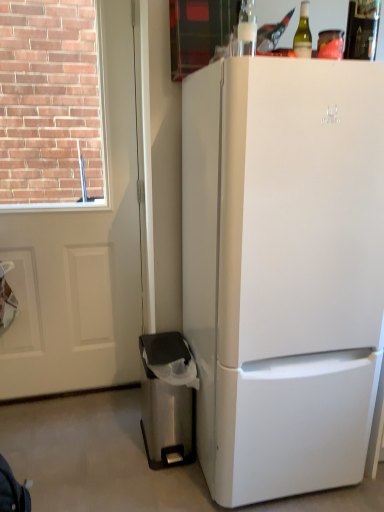
Describe the element at coordinates (303, 33) in the screenshot. Image resolution: width=384 pixels, height=512 pixels. I see `green glass bottle at upper center, which ranks as the second bottle in right-to-left order` at that location.

I want to click on white matte screen door at left, so click(x=81, y=254).

Describe the element at coordinates (81, 254) in the screenshot. I see `white matte screen door at left` at that location.

Where is `white matte refrigerator at right`? This screenshot has height=512, width=384. white matte refrigerator at right is located at coordinates (283, 270).

The width and height of the screenshot is (384, 512). I want to click on stainless steel trash can at lower left, so click(x=168, y=399).

Where is `green glass bottle at upper right, which is the 2th bottle from left to right`? This screenshot has width=384, height=512. green glass bottle at upper right, which is the 2th bottle from left to right is located at coordinates (362, 29).

Image resolution: width=384 pixels, height=512 pixels. Find the location of `green glass bottle at upper center, arranged as the 1th bottle when viewed from the left`. green glass bottle at upper center, arranged as the 1th bottle when viewed from the left is located at coordinates (303, 33).

Are white matte refrigerator at right and stainless steel trash can at lower left beside each other?

No, white matte refrigerator at right is not beside stainless steel trash can at lower left.

Is white matte refrigerator at right facing away from stainless steel trash can at lower left?

No, white matte refrigerator at right's orientation is not away from stainless steel trash can at lower left.

From a real-world perspective, is white matte refrigerator at right positioned above or below stainless steel trash can at lower left?

Clearly, from a real-world perspective, white matte refrigerator at right is above stainless steel trash can at lower left.

Is white matte refrigerator at right at the left side of stainless steel trash can at lower left?

Incorrect, white matte refrigerator at right is not on the left side of stainless steel trash can at lower left.

Could you tell me if white matte refrigerator at right is turned towards green glass bottle at upper right, which is the 2th bottle from left to right?

No.

Does white matte refrigerator at right have a lesser height compared to green glass bottle at upper right, which is the 2th bottle from left to right?

Incorrect, the height of white matte refrigerator at right does not fall short of that of green glass bottle at upper right, which is the 2th bottle from left to right.

Which object is wider, white matte refrigerator at right or green glass bottle at upper right, arranged as the 1th bottle when viewed from the right?

With larger width is white matte refrigerator at right.

Where is `bottle that is the 1st object above the white matte refrigerator at right (from a real-world perspective)`? This screenshot has height=512, width=384. bottle that is the 1st object above the white matte refrigerator at right (from a real-world perspective) is located at coordinates (303, 33).

Is white matte refrigerator at right situated inside green glass bottle at upper center, arranged as the 1th bottle when viewed from the left, or outside?

white matte refrigerator at right exists outside the volume of green glass bottle at upper center, arranged as the 1th bottle when viewed from the left.

Is white matte refrigerator at right with green glass bottle at upper center, arranged as the 1th bottle when viewed from the left?

There is a gap between white matte refrigerator at right and green glass bottle at upper center, arranged as the 1th bottle when viewed from the left.

Would you consider green glass bottle at upper center, which ranks as the second bottle in right-to-left order, to be distant from white matte refrigerator at right?

No, green glass bottle at upper center, which ranks as the second bottle in right-to-left order, is in close proximity to white matte refrigerator at right.

Which object is wider, green glass bottle at upper center, arranged as the 1th bottle when viewed from the left, or white matte refrigerator at right?

white matte refrigerator at right.

From their relative heights in the image, would you say green glass bottle at upper center, arranged as the 1th bottle when viewed from the left, is taller or shorter than white matte refrigerator at right?

In the image, green glass bottle at upper center, arranged as the 1th bottle when viewed from the left, appears to be shorter than white matte refrigerator at right.

Which is behind, point (305, 9) or point (265, 177)?

Positioned behind is point (305, 9).

Which is behind, green glass bottle at upper right, arranged as the 1th bottle when viewed from the right, or white matte refrigerator at right?

green glass bottle at upper right, arranged as the 1th bottle when viewed from the right, is further away from the camera.

Consider the image. What's the angular difference between green glass bottle at upper right, arranged as the 1th bottle when viewed from the right, and white matte refrigerator at right's facing directions?

The angular difference between green glass bottle at upper right, arranged as the 1th bottle when viewed from the right, and white matte refrigerator at right is 0.634 degrees.

Between green glass bottle at upper right, arranged as the 1th bottle when viewed from the right, and white matte refrigerator at right, which one has less height?

green glass bottle at upper right, arranged as the 1th bottle when viewed from the right, is shorter.

Could you measure the distance between green glass bottle at upper right, which is the 2th bottle from left to right, and white matte refrigerator at right?

27.56 inches.

Does point (305, 38) appear closer or farther from the camera than point (180, 375)?

Point (305, 38) is closer to the camera than point (180, 375).

Considering the relative positions of green glass bottle at upper center, which ranks as the second bottle in right-to-left order, and stainless steel trash can at lower left in the image provided, is green glass bottle at upper center, which ranks as the second bottle in right-to-left order, to the right of stainless steel trash can at lower left from the viewer's perspective?

Yes.

Considering their positions, is green glass bottle at upper center, which ranks as the second bottle in right-to-left order, located in front of or behind stainless steel trash can at lower left?

Visually, green glass bottle at upper center, which ranks as the second bottle in right-to-left order, is located in front of stainless steel trash can at lower left.

Based on the photo, which of these two, green glass bottle at upper center, arranged as the 1th bottle when viewed from the left, or stainless steel trash can at lower left, is wider?

Wider between the two is stainless steel trash can at lower left.

Considering the sizes of objects green glass bottle at upper center, which ranks as the second bottle in right-to-left order, and green glass bottle at upper right, arranged as the 1th bottle when viewed from the right, in the image provided, who is smaller, green glass bottle at upper center, which ranks as the second bottle in right-to-left order, or green glass bottle at upper right, arranged as the 1th bottle when viewed from the right,?

With smaller size is green glass bottle at upper center, which ranks as the second bottle in right-to-left order.

Is green glass bottle at upper center, arranged as the 1th bottle when viewed from the left, placed right next to green glass bottle at upper right, arranged as the 1th bottle when viewed from the right?

No, green glass bottle at upper center, arranged as the 1th bottle when viewed from the left, is not in contact with green glass bottle at upper right, arranged as the 1th bottle when viewed from the right.

Considering the positions of objects green glass bottle at upper center, which ranks as the second bottle in right-to-left order, and green glass bottle at upper right, which is the 2th bottle from left to right, in the image provided, who is more to the left, green glass bottle at upper center, which ranks as the second bottle in right-to-left order, or green glass bottle at upper right, which is the 2th bottle from left to right,?

From the viewer's perspective, green glass bottle at upper center, which ranks as the second bottle in right-to-left order, appears more on the left side.

Identify the location of refrigerator located in front of the stainless steel trash can at lower left. (283, 270).

You are a GUI agent. You are given a task and a screenshot of the screen. Output one action in this format:
    pyautogui.click(x=<x>, y=<y>)
    Task: Click on the bottle that is the 2nd object to the right of the white matte refrigerator at right, starting at the anchor
    
    Given the screenshot: What is the action you would take?
    pyautogui.click(x=362, y=29)

Based on their spatial positions, is white matte refrigerator at right or green glass bottle at upper right, which is the 2th bottle from left to right, closer to stainless steel trash can at lower left?

white matte refrigerator at right is positioned closer to the anchor stainless steel trash can at lower left.

Looking at the image, which one is located further to green glass bottle at upper center, arranged as the 1th bottle when viewed from the left, stainless steel trash can at lower left or white matte screen door at left?

stainless steel trash can at lower left lies further to green glass bottle at upper center, arranged as the 1th bottle when viewed from the left, than the other object.

From the image, which object appears to be nearer to stainless steel trash can at lower left, green glass bottle at upper right, arranged as the 1th bottle when viewed from the right, or white matte screen door at left?

Among the two, white matte screen door at left is located nearer to stainless steel trash can at lower left.

Considering their positions, is green glass bottle at upper center, arranged as the 1th bottle when viewed from the left, positioned further to white matte screen door at left than stainless steel trash can at lower left?

green glass bottle at upper center, arranged as the 1th bottle when viewed from the left.

When comparing their distances from green glass bottle at upper center, arranged as the 1th bottle when viewed from the left, does green glass bottle at upper right, arranged as the 1th bottle when viewed from the right, or stainless steel trash can at lower left seem closer?

green glass bottle at upper right, arranged as the 1th bottle when viewed from the right, is positioned closer to the anchor green glass bottle at upper center, arranged as the 1th bottle when viewed from the left.

When comparing their distances from green glass bottle at upper center, arranged as the 1th bottle when viewed from the left, does white matte refrigerator at right or stainless steel trash can at lower left seem further?

The object further to green glass bottle at upper center, arranged as the 1th bottle when viewed from the left, is stainless steel trash can at lower left.

Based on their spatial positions, is stainless steel trash can at lower left or white matte refrigerator at right further from white matte screen door at left?

Among the two, white matte refrigerator at right is located further to white matte screen door at left.

Looking at the image, which one is located further to green glass bottle at upper right, arranged as the 1th bottle when viewed from the right, stainless steel trash can at lower left or green glass bottle at upper center, which ranks as the second bottle in right-to-left order?

stainless steel trash can at lower left is positioned further to the anchor green glass bottle at upper right, arranged as the 1th bottle when viewed from the right.

Image resolution: width=384 pixels, height=512 pixels. What are the coordinates of `refrigerator between white matte screen door at left and green glass bottle at upper center, arranged as the 1th bottle when viewed from the left, in the horizontal direction` in the screenshot? It's located at (283, 270).

Where is `bottle between green glass bottle at upper right, which is the 2th bottle from left to right, and white matte refrigerator at right in the up-down direction`? bottle between green glass bottle at upper right, which is the 2th bottle from left to right, and white matte refrigerator at right in the up-down direction is located at coordinates (303, 33).

Find the location of `refrigerator between green glass bottle at upper center, which ranks as the second bottle in right-to-left order, and stainless steel trash can at lower left from top to bottom`. refrigerator between green glass bottle at upper center, which ranks as the second bottle in right-to-left order, and stainless steel trash can at lower left from top to bottom is located at coordinates (283, 270).

Where is `trash bin/can located between white matte screen door at left and white matte refrigerator at right in the left-right direction`? The height and width of the screenshot is (512, 384). trash bin/can located between white matte screen door at left and white matte refrigerator at right in the left-right direction is located at coordinates (168, 399).